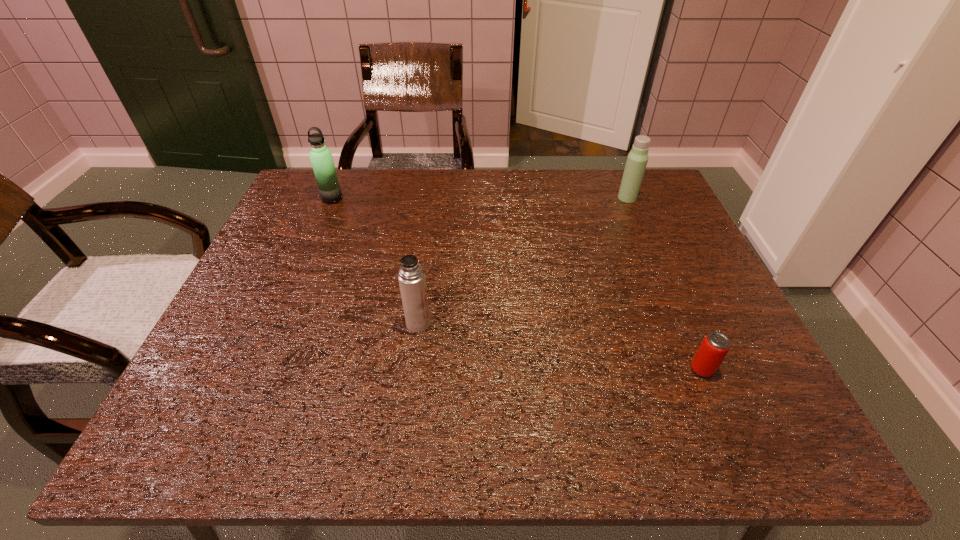
Identify the location of vacant region located 0.150m on the face of the duckling. (523, 210).

This screenshot has width=960, height=540. What are the coordinates of `vacant space located on the face of the duckling` in the screenshot? It's located at (509, 244).

Image resolution: width=960 pixels, height=540 pixels. In order to click on vacant region located 0.110m on the label of the tallest object in this screenshot , I will do `click(597, 226)`.

The width and height of the screenshot is (960, 540). I want to click on vacant space located 0.270m on the label of the tallest object, so click(x=556, y=252).

Where is `vacant region located 0.390m on the label of the tallest object`? The height and width of the screenshot is (540, 960). vacant region located 0.390m on the label of the tallest object is located at coordinates (522, 274).

What are the coordinates of `duckling that is positioned at the far edge` in the screenshot? It's located at (321, 158).

This screenshot has width=960, height=540. I want to click on alcohol that is at the far edge, so click(x=709, y=356).

The width and height of the screenshot is (960, 540). I want to click on bottle that is at the right edge, so click(x=411, y=276).

The image size is (960, 540). What are the coordinates of `alcohol located in the right edge section of the desktop` in the screenshot? It's located at (x=709, y=356).

Locate an element on the screen. The image size is (960, 540). object present at the far right corner is located at coordinates (709, 356).